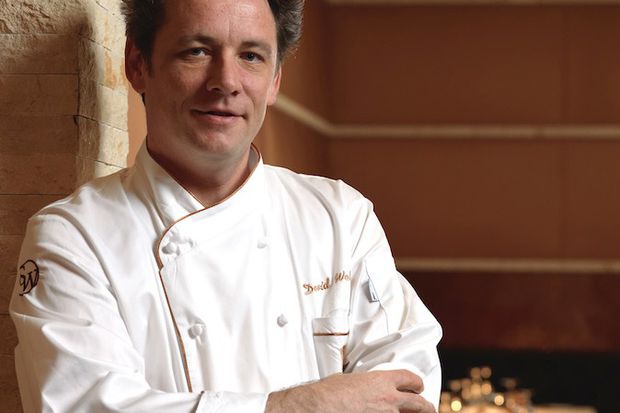
I want to click on wall, so click(470, 171).